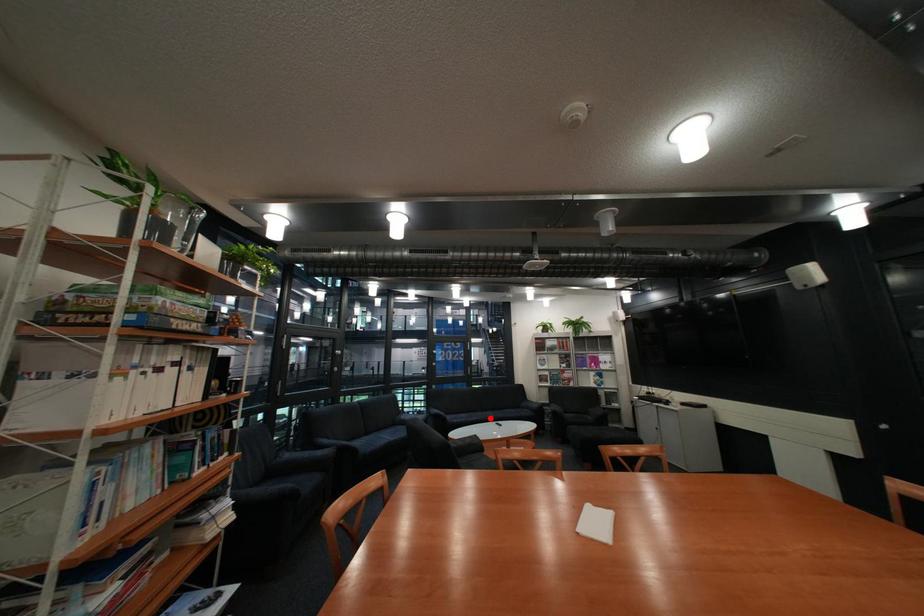
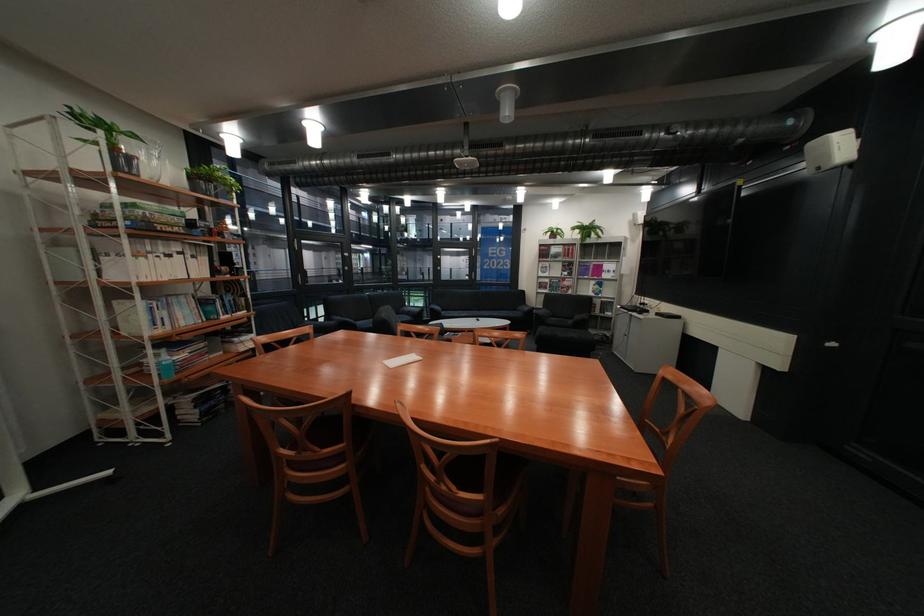
Find the pixel in the second image that matches the highlighted location in the first image.

(481, 315)